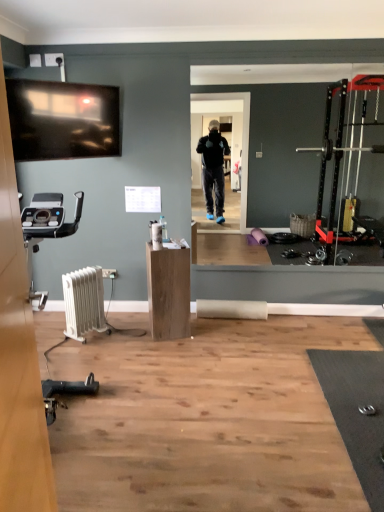
Image resolution: width=384 pixels, height=512 pixels. I want to click on vacant area that is in front of wooden cabinet at center, so [166, 350].